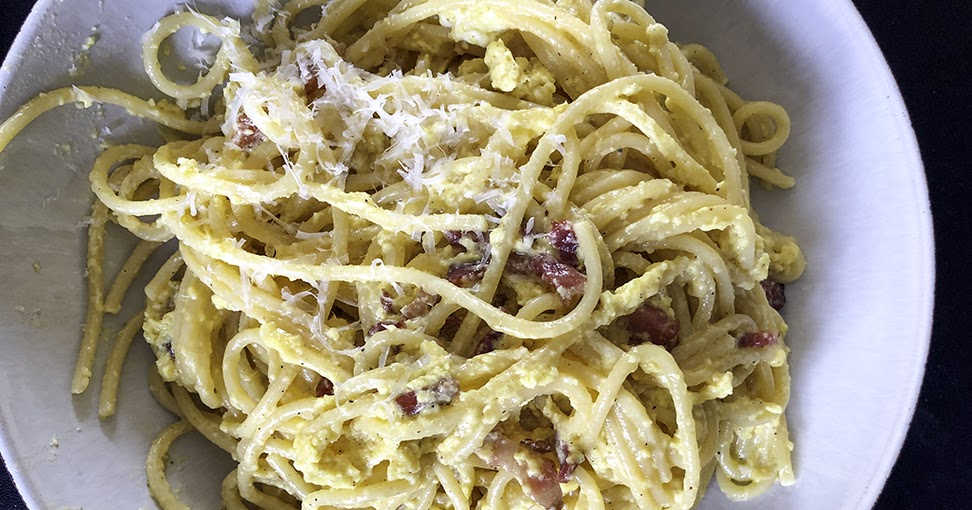
This screenshot has height=510, width=972. I want to click on pasta bowl, so click(x=898, y=266).